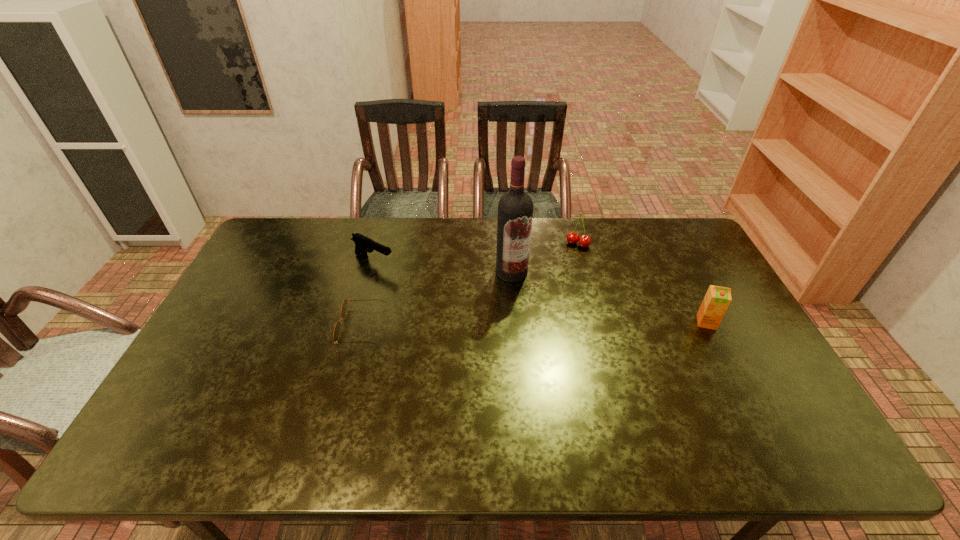
Where is `vacant space located 0.100m on the face of the shortest object`? This screenshot has width=960, height=540. vacant space located 0.100m on the face of the shortest object is located at coordinates (308, 326).

This screenshot has width=960, height=540. Find the location of `free location located on the back of the rightmost object`. free location located on the back of the rightmost object is located at coordinates (667, 245).

What are the coordinates of `vacant space located 0.250m on the front-facing side of the pistol` in the screenshot? It's located at (451, 297).

Identify the location of vacant space located on the front-facing side of the pistol. This screenshot has height=540, width=960. (451, 297).

Where is `blank space located on the front-facing side of the pistol`? blank space located on the front-facing side of the pistol is located at coordinates (428, 286).

Image resolution: width=960 pixels, height=540 pixels. Identify the location of free region located with the stems of the third tallest object pointing upwards. (545, 303).

Locate an element on the screen. This screenshot has height=540, width=960. free space located 0.260m with the stems of the third tallest object pointing upwards is located at coordinates (549, 295).

At what (x,y) coordinates should I click in order to perform the action: click on free space located with the stems of the third tallest object pointing upwards. Please return your answer as a coordinate pair (x, y). Looking at the image, I should click on (566, 264).

Find the location of a particular element. This screenshot has height=540, width=960. free spot located 0.380m on the label of the wine bottle is located at coordinates (524, 382).

Locate an element on the screen. The width and height of the screenshot is (960, 540). free space located 0.170m on the label of the wine bottle is located at coordinates (517, 322).